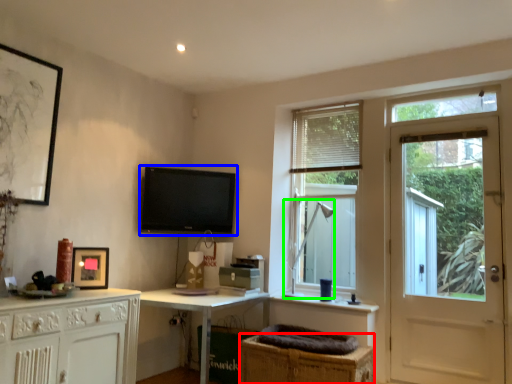
Question: Which object is positioned closest to cabinetry (highlighted by a red box)? Select from television (highlighted by a blue box) and table lamp (highlighted by a green box).

Choices:
 (A) television
 (B) table lamp

Answer: (B)